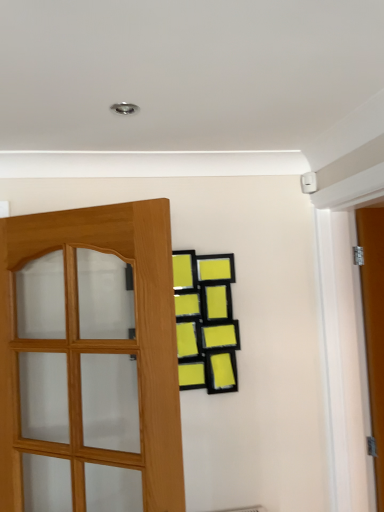
What do you see at coordinates (136, 325) in the screenshot? The width and height of the screenshot is (384, 512). I see `light brown wooden door at left` at bounding box center [136, 325].

At what (x,y) coordinates should I click in order to perform the action: click on light brown wooden door at left. Please return your answer as a coordinate pair (x, y). The width and height of the screenshot is (384, 512). Looking at the image, I should click on (136, 325).

The width and height of the screenshot is (384, 512). What are the coordinates of `light brown wooden door at left` in the screenshot? It's located at (136, 325).